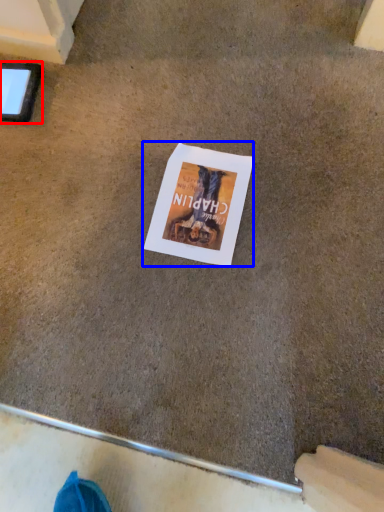
Question: Which of the following is the farthest to the observer, tablet computer (highlighted by a red box) or flyer (highlighted by a blue box)?

Choices:
 (A) tablet computer
 (B) flyer

Answer: (A)